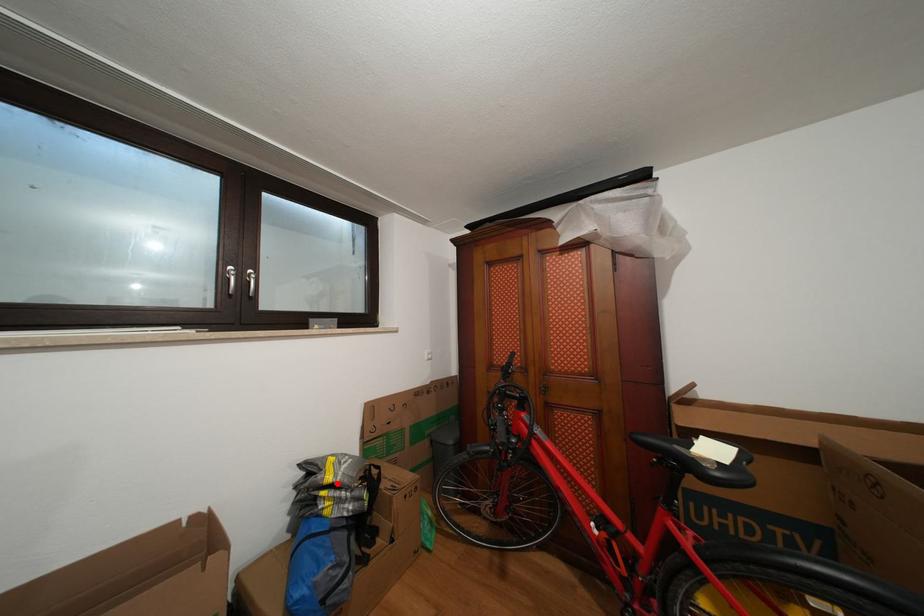
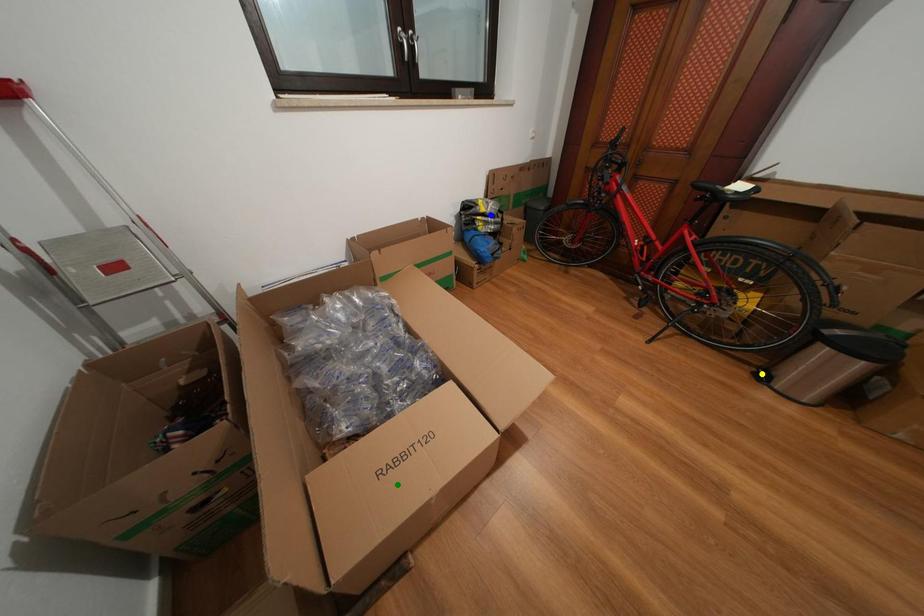
Question: I am providing you with two images of the same scene from different viewpoints. A red point is marked on the first image. You are given multiple points on the second image. Can you choose the point in image 2 that corresponds to the point in image 1?

Choices:
 (A) blue point
 (B) green point
 (C) yellow point

Answer: (A)